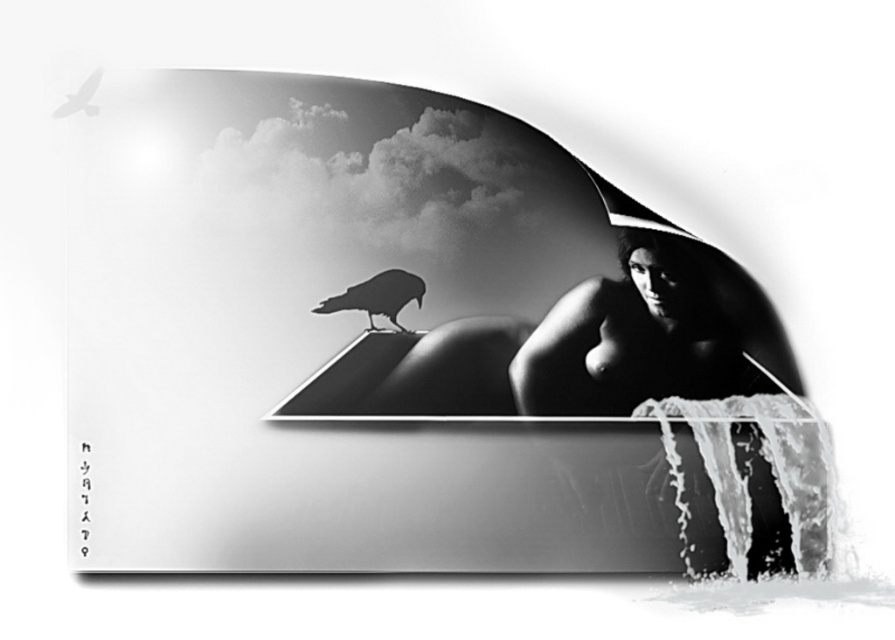
You are an observer looking at the image. The smooth skin woman at center and the black matte crow at upper left are both visible. Which object is positioned higher in the image?

The black matte crow at upper left is positioned higher than the smooth skin woman at center.

You are an ornithologist observing the black matte bird at center and the black matte crow at upper left in the image. Which of these two birds is larger in size?

The black matte bird at center is bigger than the black matte crow at upper left.

You are an artist analyzing the composition of this black and white image. The scene has a smooth skin woman at center and a black matte bird at center. Which object takes up more space in the image?

The smooth skin woman at center takes up more space in the image because her width is larger than that of the black matte bird at center.